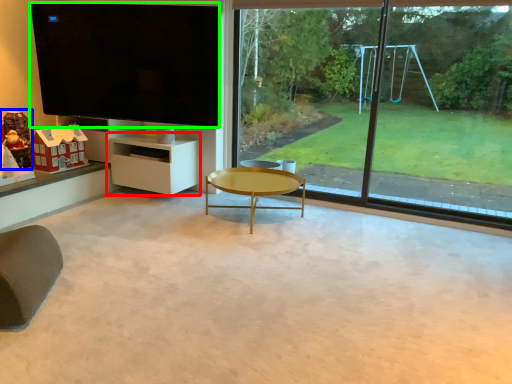
Question: Which is nearer to the shelf (highlighted by a red box)? toy (highlighted by a blue box) or window screen (highlighted by a green box).

Choices:
 (A) toy
 (B) window screen

Answer: (B)